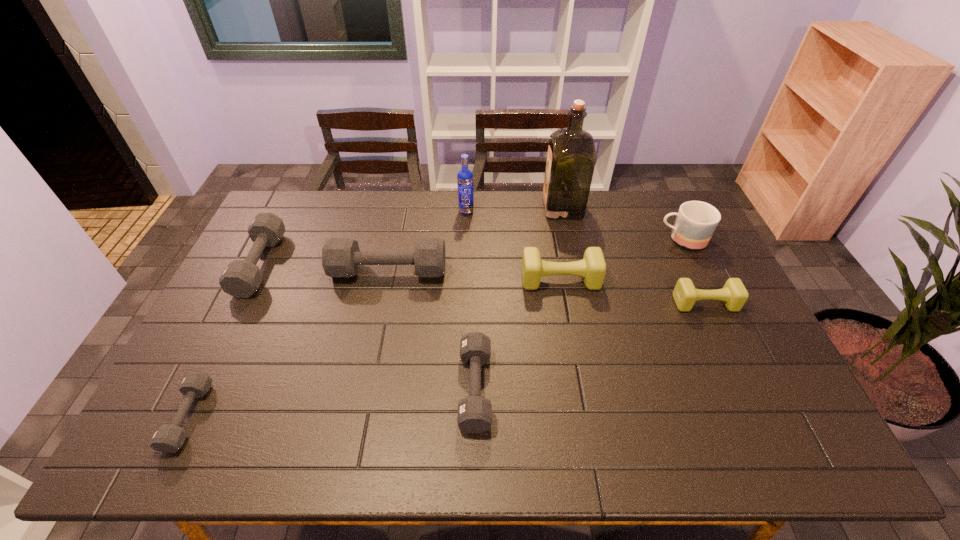
This screenshot has height=540, width=960. What are the coordinates of `mug positioned at the far edge` in the screenshot? It's located at (696, 221).

Locate an element on the screen. mug at the right edge is located at coordinates (696, 221).

This screenshot has height=540, width=960. I want to click on dumbbell that is at the right edge, so click(734, 295).

Locate an element on the screen. The image size is (960, 540). object situated at the near left corner is located at coordinates (168, 438).

Where is `object situated at the far right corner`? The height and width of the screenshot is (540, 960). object situated at the far right corner is located at coordinates pos(696,221).

This screenshot has height=540, width=960. I want to click on vacant area at the far edge of the desktop, so click(x=435, y=212).

In the image, there is a desktop. Where is `vacant space at the near edge`? This screenshot has height=540, width=960. vacant space at the near edge is located at coordinates (580, 452).

Locate an element on the screen. The image size is (960, 540). free region at the left edge of the desktop is located at coordinates (242, 359).

The width and height of the screenshot is (960, 540). In the image, there is a desktop. Identify the location of vacant space at the right edge. (724, 309).

Find the location of a particular element. free spot between the rightmost dumbbell and the left olive dumbbell is located at coordinates click(633, 292).